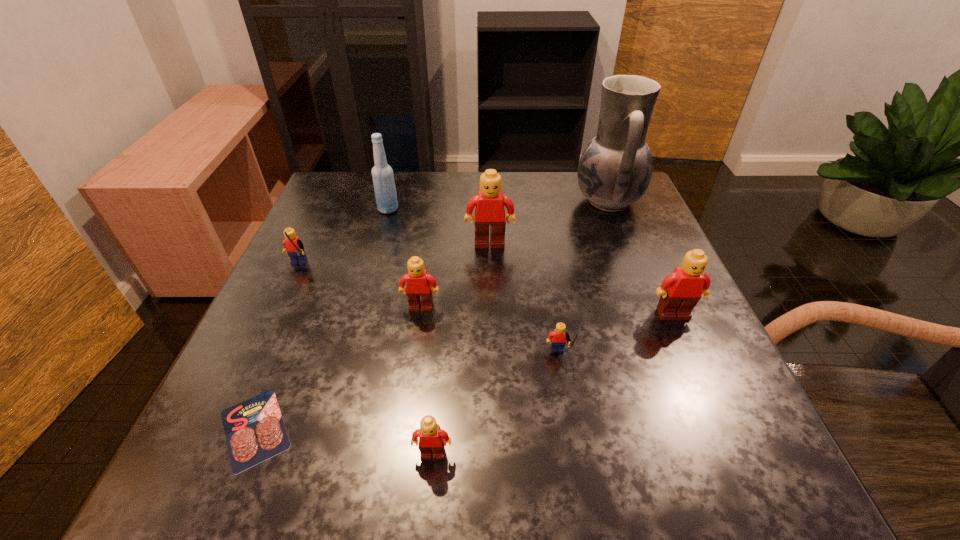
The image size is (960, 540). Find the location of `pitcher at the right edge`. pitcher at the right edge is located at coordinates click(x=615, y=169).

Where is `Lego that is at the right edge`? Lego that is at the right edge is located at coordinates (681, 290).

Locate an element on the screen. The width and height of the screenshot is (960, 540). object that is at the far left corner is located at coordinates (383, 179).

Identify the location of object situated at the near left corner. (254, 429).

At what (x,y) coordinates should I click in order to perform the action: click on object located in the far right corner section of the desktop. Please return your answer as a coordinate pair (x, y). The image size is (960, 540). Looking at the image, I should click on (615, 169).

In the image, there is a desktop. Identify the location of free region at the far edge. (x=534, y=179).

This screenshot has height=540, width=960. I want to click on free location at the near edge of the desktop, so click(570, 435).

In order to click on vacant space at the left edge of the desktop in this screenshot , I will do `click(253, 335)`.

The height and width of the screenshot is (540, 960). Identify the location of blank space at the right edge of the desktop. (635, 351).

In the image, there is a desktop. Where is `vacant region at the far left corner`? The width and height of the screenshot is (960, 540). vacant region at the far left corner is located at coordinates point(370,218).